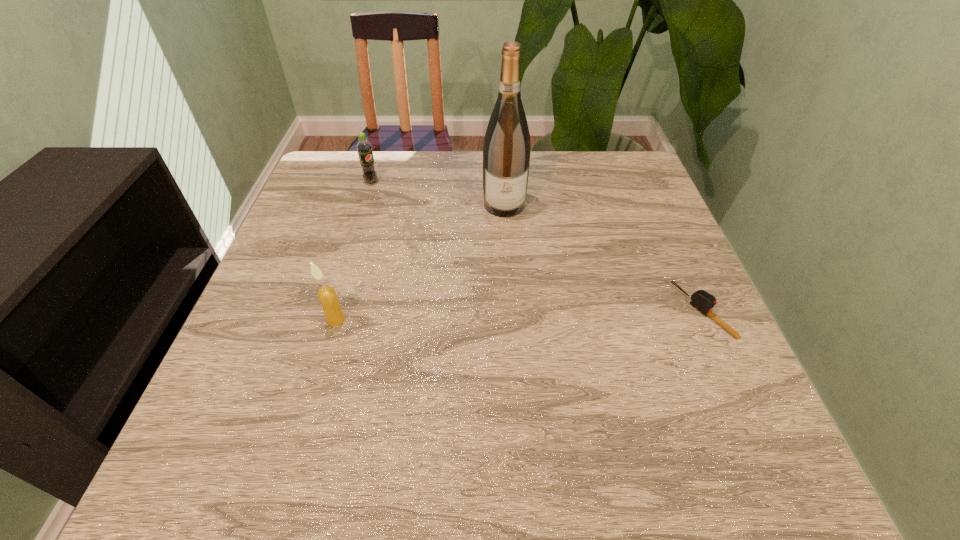
What are the coordinates of `candle` in the screenshot? It's located at (328, 298).

Find the location of `the rightmost object`. the rightmost object is located at coordinates (703, 301).

Find the location of a particular element. The image size is (960, 540). the shortest object is located at coordinates (703, 301).

At what (x,y) coordinates should I click in order to perform the action: click on the tallest object. Please return your answer as a coordinate pair (x, y). Looking at the image, I should click on (506, 152).

The height and width of the screenshot is (540, 960). Identify the location of the third nearest object. coord(506,152).

At what (x,y) coordinates should I click in order to perform the action: click on the farthest object. Please return your answer as a coordinate pair (x, y). The height and width of the screenshot is (540, 960). Looking at the image, I should click on (364, 148).

Find the location of a particular element. the second shortest object is located at coordinates (364, 148).

Find the location of `blank space located on the right of the candle`. blank space located on the right of the candle is located at coordinates (480, 320).

The height and width of the screenshot is (540, 960). What are the coordinates of `free space located on the left of the shortest object` in the screenshot? It's located at (562, 311).

I want to click on free space located on the label of the tallest object, so click(509, 254).